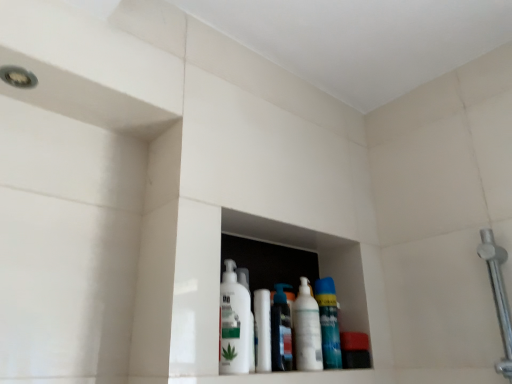
Question: From a real-world perspective, is translucent plastic spray can at center, which is counted as the second cleaning product, starting from the left, above or below white glossy mouthwash at center?

Choices:
 (A) above
 (B) below

Answer: (A)

Question: Relative to white glossy mouthwash at center, is translucent plastic spray can at center, arranged as the 3th cleaning product when viewed from the right, in front or behind?

Choices:
 (A) behind
 (B) front

Answer: (A)

Question: Which is farther from the white glossy bottle at center, which ranks as the third cleaning product in left-to-right order?

Choices:
 (A) white glossy mouthwash at center
 (B) translucent plastic spray can at center, which is counted as the second cleaning product, starting from the left
 (C) blue glossy spray can at center, positioned as the first cleaning product in right-to-left order
 (D) polished chrome shower arm at right
 (E) white glossy lotion at center, which appears as the 4th cleaning product when viewed from the right

Answer: (D)

Question: Estimate the real-world distances between objects in this image. Which object is farther from the white glossy bottle at center, which is counted as the 2th cleaning product, starting from the right?

Choices:
 (A) white glossy mouthwash at center
 (B) polished chrome shower arm at right
 (C) white glossy lotion at center, which appears as the 4th cleaning product when viewed from the right
 (D) blue glossy spray can at center, positioned as the first cleaning product in right-to-left order
 (E) translucent plastic spray can at center, which is counted as the second cleaning product, starting from the left

Answer: (B)